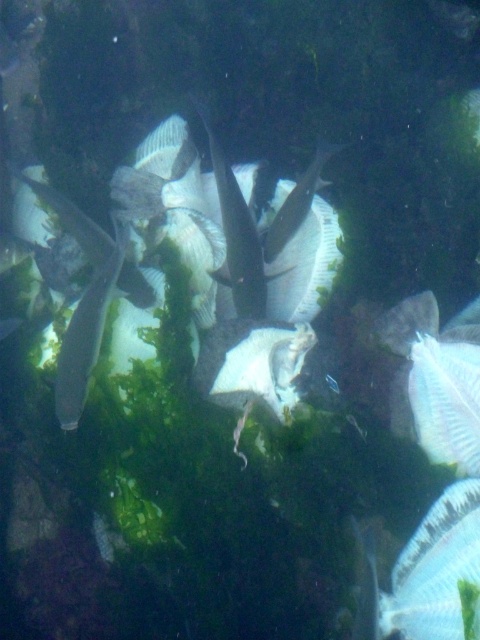
You are a diver exploring this underwater scene. You notice two points marked in the image. Which point is closer to you, point at (479, 540) or point at (108, 278)?

Point at (479, 540) is closer to you than point at (108, 278).

You are a marine biologist observing the underwater scene. You need to determine the distance between the translucent white fish at lower right and the silvery metallic fish at left to assess their social behavior. Can you confirm if they are within a 30 inch interaction range?

The translucent white fish at lower right is 27.52 inches from the silvery metallic fish at left, which is within the 30 inch interaction range, so they are considered within the interaction range for social behavior assessment.